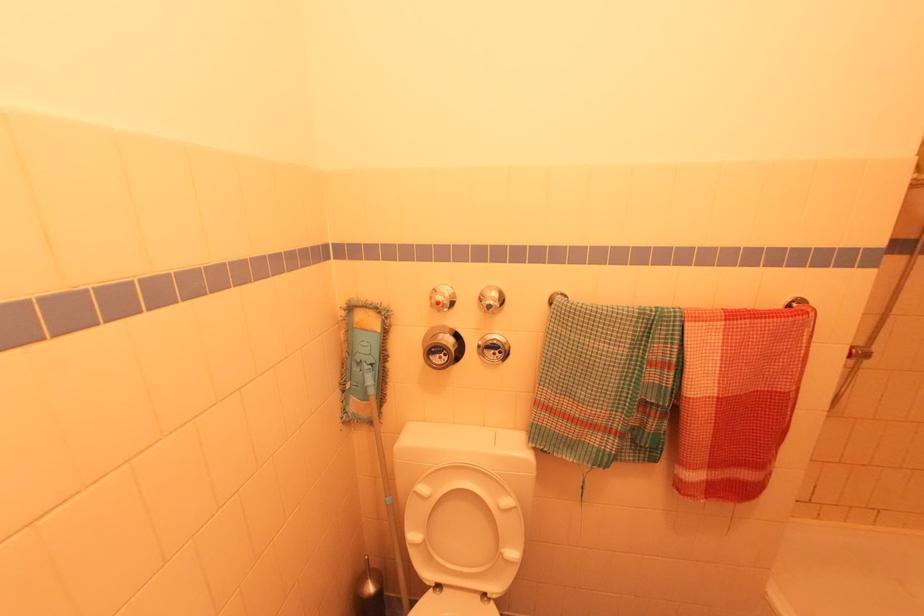
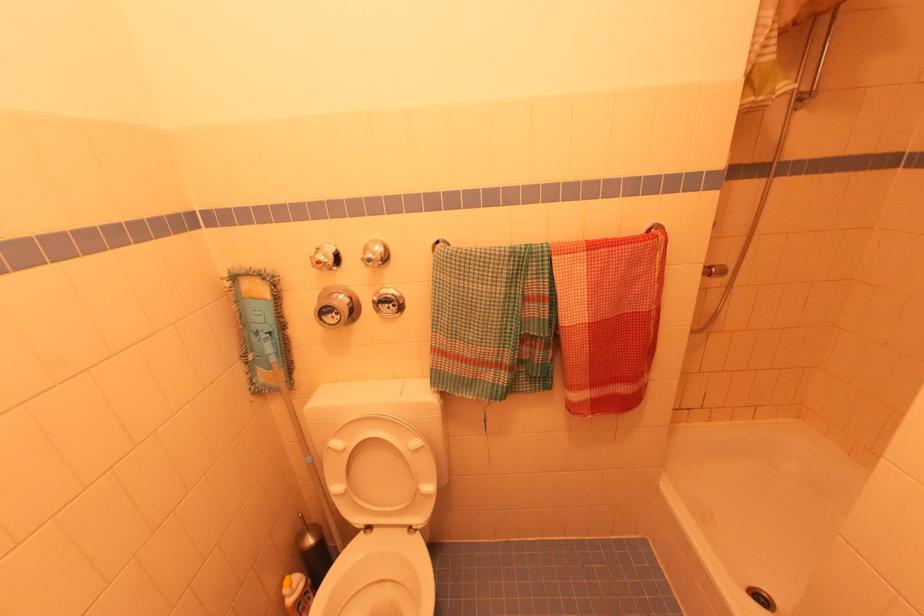
Find the pixel in the second image that matches pixel 440 357 in the first image.

(332, 315)